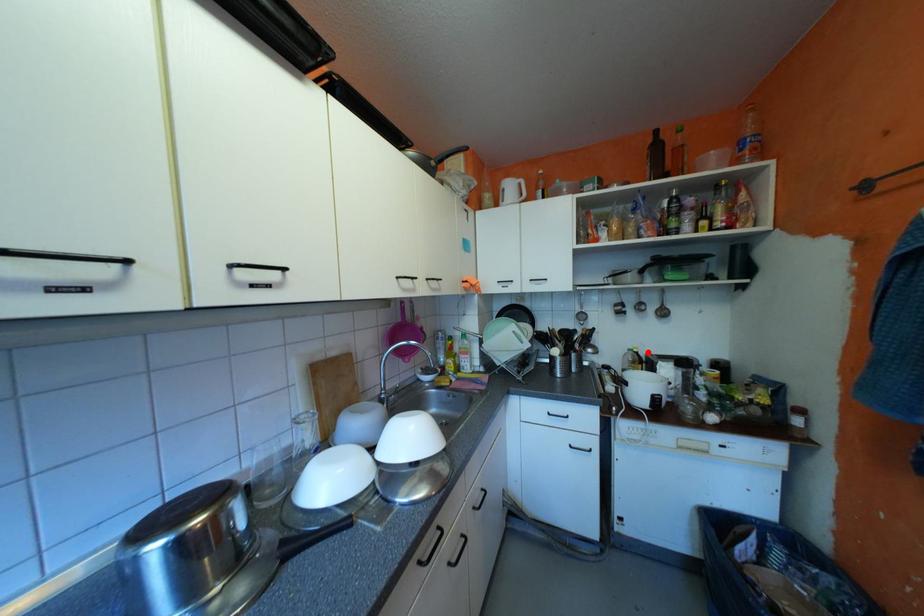
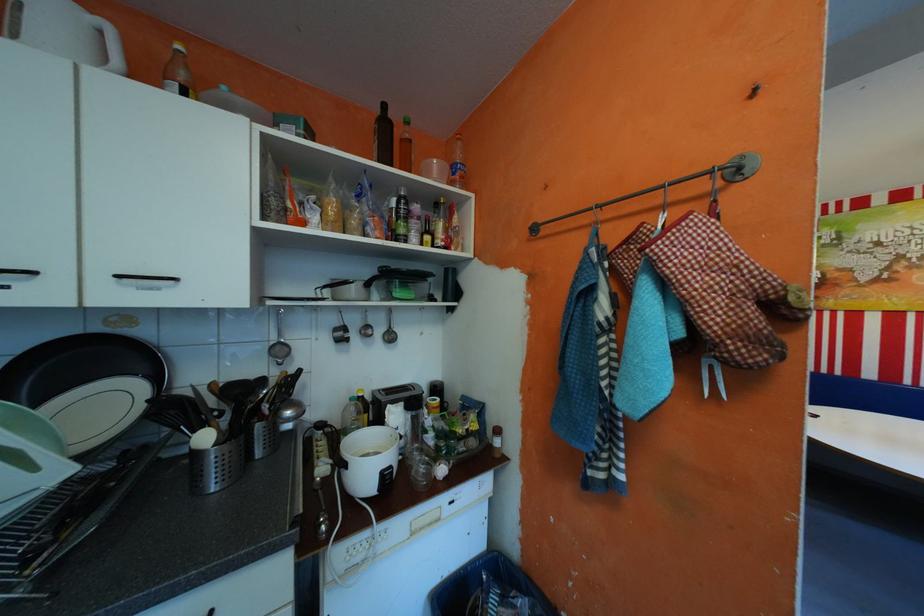
Where in the second image is the point corresponding to the highlighted location from the first image?

(372, 397)